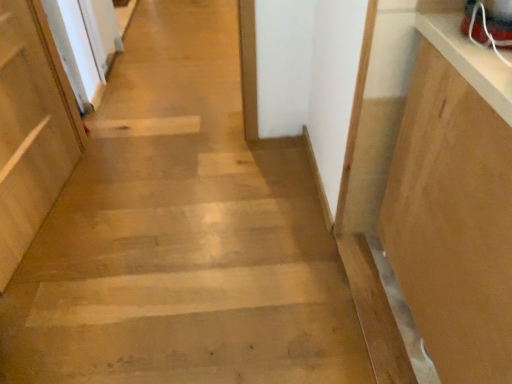
Question: Does matte wood door at left have a lesser width compared to light brown wood cabinet at right?

Choices:
 (A) yes
 (B) no

Answer: (A)

Question: Is matte wood door at left wider than light brown wood cabinet at right?

Choices:
 (A) no
 (B) yes

Answer: (A)

Question: Is the surface of matte wood door at left in direct contact with light brown wood cabinet at right?

Choices:
 (A) no
 (B) yes

Answer: (A)

Question: From a real-world perspective, is matte wood door at left on light brown wood cabinet at right?

Choices:
 (A) no
 (B) yes

Answer: (A)

Question: Could you tell me if matte wood door at left is facing light brown wood cabinet at right?

Choices:
 (A) yes
 (B) no

Answer: (A)

Question: Is matte wood door at left to the right of light brown wood cabinet at right from the viewer's perspective?

Choices:
 (A) yes
 (B) no

Answer: (B)

Question: Is light brown wood cabinet at right facing towards matte wood door at left?

Choices:
 (A) yes
 (B) no

Answer: (B)

Question: Does light brown wood cabinet at right lie behind matte wood door at left?

Choices:
 (A) no
 (B) yes

Answer: (A)

Question: From a real-world perspective, does light brown wood cabinet at right sit lower than matte wood door at left?

Choices:
 (A) yes
 (B) no

Answer: (B)

Question: Would you say matte wood door at left is part of light brown wood cabinet at right's contents?

Choices:
 (A) no
 (B) yes

Answer: (A)

Question: Is light brown wood cabinet at right wider than matte wood door at left?

Choices:
 (A) no
 (B) yes

Answer: (B)

Question: Are light brown wood cabinet at right and matte wood door at left located far from each other?

Choices:
 (A) no
 (B) yes

Answer: (B)

Question: Is matte wood door at left situated inside light brown wood cabinet at right or outside?

Choices:
 (A) inside
 (B) outside

Answer: (B)